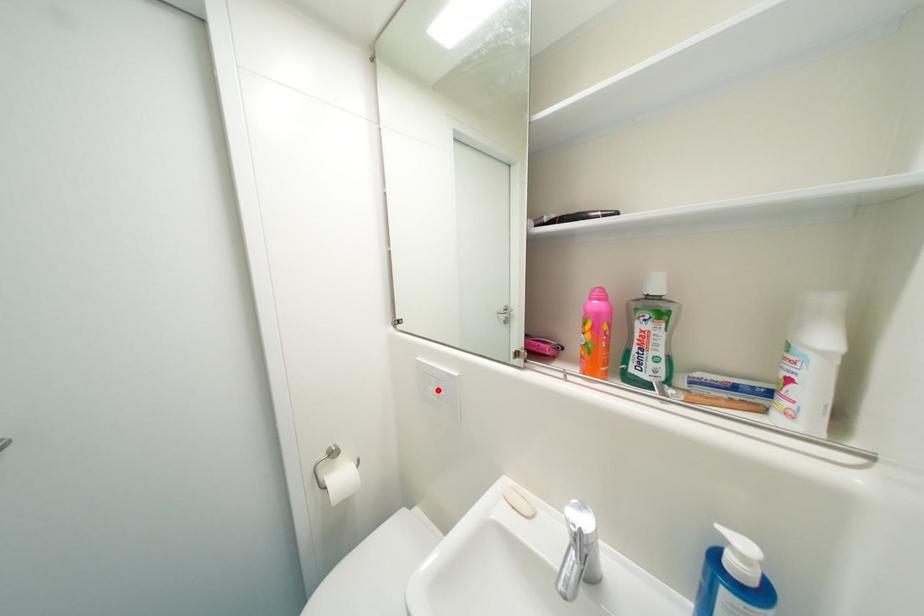
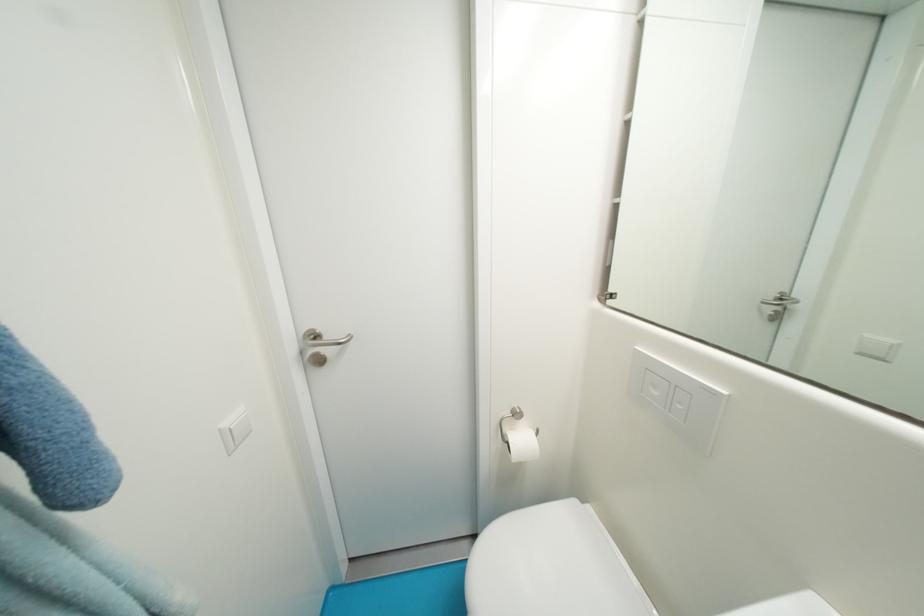
Where in the second image is the point corresponding to the highlighted location from the first image?

(662, 395)